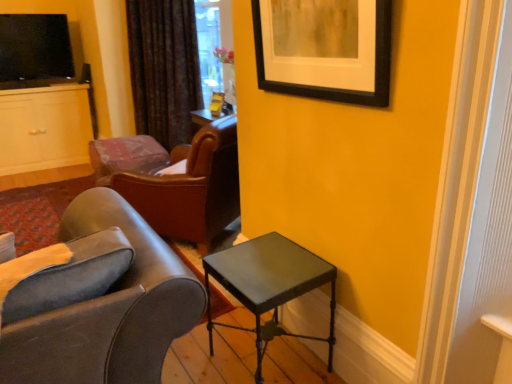
Question: Is black matte picture frame at upper right smaller than leather at center, marked as the first chair in a back-to-front arrangement?

Choices:
 (A) no
 (B) yes

Answer: (B)

Question: Can you confirm if black matte picture frame at upper right is thinner than leather at center, acting as the 2th chair starting from the front?

Choices:
 (A) yes
 (B) no

Answer: (A)

Question: Does black matte picture frame at upper right have a greater width compared to leather at center, acting as the 2th chair starting from the front?

Choices:
 (A) yes
 (B) no

Answer: (B)

Question: Is black matte picture frame at upper right positioned with its back to leather at center, acting as the 2th chair starting from the front?

Choices:
 (A) no
 (B) yes

Answer: (A)

Question: From the image's perspective, is black matte picture frame at upper right on leather at center, marked as the first chair in a back-to-front arrangement?

Choices:
 (A) no
 (B) yes

Answer: (B)

Question: Is black matte picture frame at upper right completely or partially outside of leather at center, marked as the first chair in a back-to-front arrangement?

Choices:
 (A) yes
 (B) no

Answer: (A)

Question: Is leather at center, marked as the first chair in a back-to-front arrangement, beside velvet dark brown curtain at upper center?

Choices:
 (A) no
 (B) yes

Answer: (A)

Question: Is leather at center, acting as the 2th chair starting from the front, facing towards velvet dark brown curtain at upper center?

Choices:
 (A) no
 (B) yes

Answer: (A)

Question: From a real-world perspective, is leather at center, marked as the first chair in a back-to-front arrangement, below velvet dark brown curtain at upper center?

Choices:
 (A) no
 (B) yes

Answer: (B)

Question: Can you confirm if leather at center, marked as the first chair in a back-to-front arrangement, is smaller than velvet dark brown curtain at upper center?

Choices:
 (A) no
 (B) yes

Answer: (B)

Question: Considering the relative sizes of leather at center, acting as the 2th chair starting from the front, and velvet dark brown curtain at upper center in the image provided, is leather at center, acting as the 2th chair starting from the front, wider than velvet dark brown curtain at upper center?

Choices:
 (A) no
 (B) yes

Answer: (B)

Question: Is leather at center, acting as the 2th chair starting from the front, positioned before velvet dark brown curtain at upper center?

Choices:
 (A) no
 (B) yes

Answer: (B)

Question: From a real-world perspective, is black matte picture frame at upper right under velvet dark brown curtain at upper center?

Choices:
 (A) yes
 (B) no

Answer: (B)